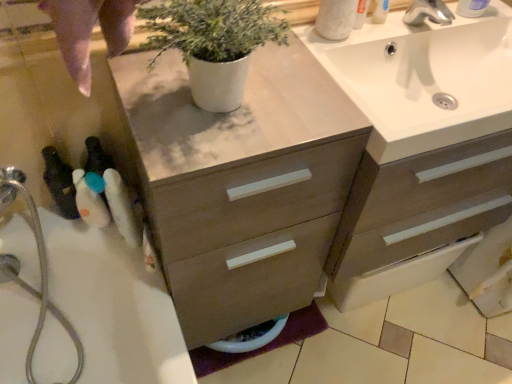
The image size is (512, 384). Find the location of `vacant space in between white matte toilet paper at upper right and silver metallic faucet at upper right`. vacant space in between white matte toilet paper at upper right and silver metallic faucet at upper right is located at coordinates (384, 41).